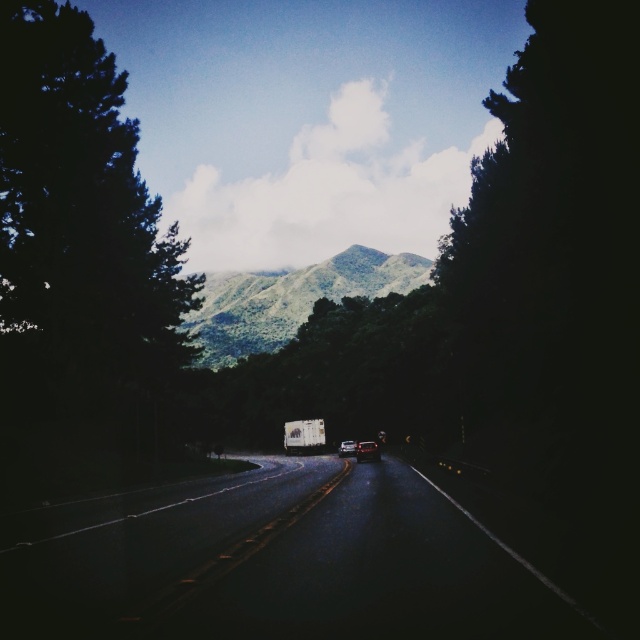
You are driving a car and want to overtake the white matte truck at center on the dark asphalt road at center. Is there enough space on the road to safely pass the truck?

The dark asphalt road at center might be wider than white matte truck at center, so there could be enough space to safely pass the truck. However, since the exact width difference isn

Based on the scene description, what is the 2D coordinate of the dark asphalt road at center?

The 2D coordinate of the dark asphalt road at center is at point (x=272, y=563).